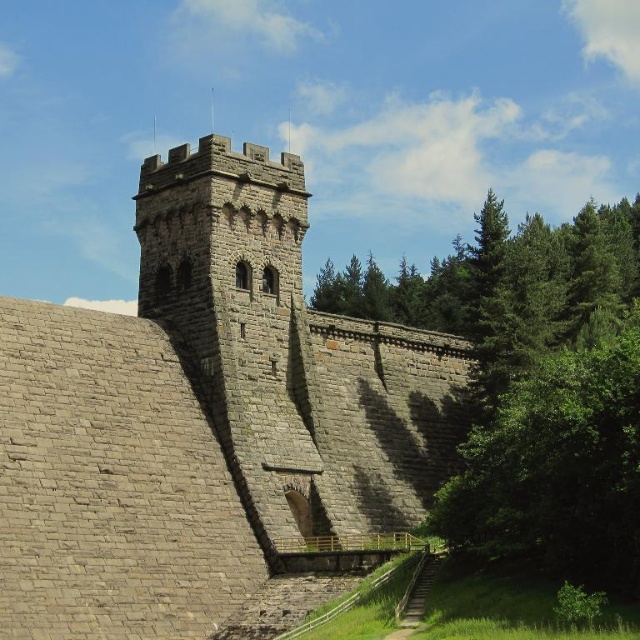
You are standing at the origin point of the image coordinate system. The image coordinate system has the origin at the bottom left corner. The x axis goes to the right and the y axis goes upward. You want to walk to the gray stone castle at center. In which direction should you walk?

The gray stone castle at center is located at point (212, 426) in the image coordinate system. Since the origin is at the bottom left corner, the x coordinate 0.666 indicates it is to the right, and the y coordinate 0.333 indicates it is above. Therefore, you should walk diagonally to the upper right direction to reach the gray stone castle at center.